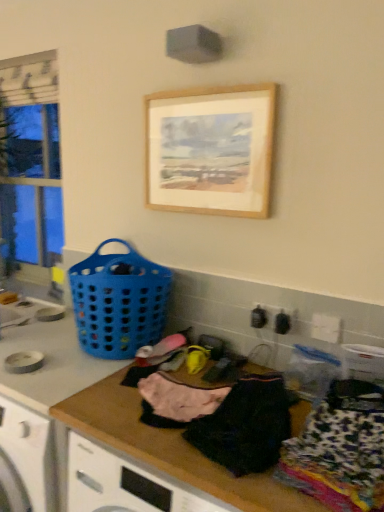
You are a GUI agent. You are given a task and a screenshot of the screen. Output one action in this format:
    pyautogui.click(x=<x>, y=<y>)
    Task: Click on the vacant space that is to the left of blue plastic basket at left
    This screenshot has width=384, height=512.
    Given the screenshot: What is the action you would take?
    pyautogui.click(x=42, y=340)